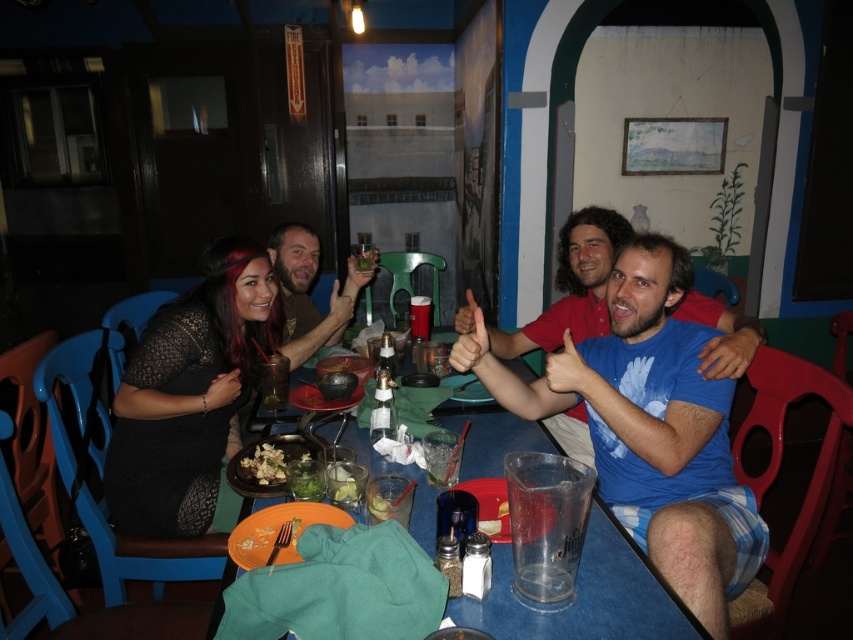
You are a waiter in the restaurant. You need to deliver a drink to the customer whose matte brown hair at center is visible. Where should you place the drink so it doesn not spill? Consider the green leafy salad at center on the table.

The matte brown hair at center is above the green leafy salad at center, so placing the drink near the salad might risk spilling onto it. Instead, place the drink away from the salad to avoid any mess.